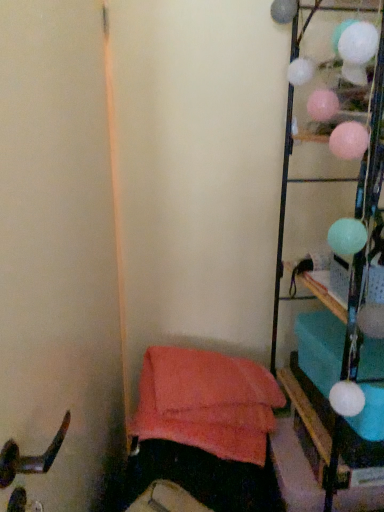
Identify the location of soft coral fabric bean bag chair at lower left. Image resolution: width=384 pixels, height=512 pixels. (207, 402).

What do you see at coordinates (207, 402) in the screenshot?
I see `soft coral fabric bean bag chair at lower left` at bounding box center [207, 402].

This screenshot has height=512, width=384. Describe the element at coordinates (373, 140) in the screenshot. I see `metallic wire rack at right` at that location.

In order to face metallic wire rack at right, should I rotate leftwards or rightwards?

To align with it, rotate right about 23.492°.

Measure the distance between metallic wire rack at right and camera.

metallic wire rack at right is 1.01 meters away from camera.

The height and width of the screenshot is (512, 384). What are the coordinates of `metallic wire rack at right` in the screenshot? It's located at (373, 140).

Locate an element on the screen. soft coral fabric bean bag chair at lower left is located at coordinates (207, 402).

Is soft coral fabric bean bag chair at lower left at the right side of metallic wire rack at right?

In fact, soft coral fabric bean bag chair at lower left is to the left of metallic wire rack at right.

Who is more distant, soft coral fabric bean bag chair at lower left or metallic wire rack at right?

soft coral fabric bean bag chair at lower left.

Is point (157, 367) closer to viewer compared to point (380, 184)?

No.

From the image's perspective, is soft coral fabric bean bag chair at lower left positioned above or below metallic wire rack at right?

soft coral fabric bean bag chair at lower left is situated lower than metallic wire rack at right in the image.

From a real-world perspective, who is located lower, soft coral fabric bean bag chair at lower left or metallic wire rack at right?

soft coral fabric bean bag chair at lower left.

Can you confirm if soft coral fabric bean bag chair at lower left is thinner than metallic wire rack at right?

Yes, soft coral fabric bean bag chair at lower left is thinner than metallic wire rack at right.

Who is taller, soft coral fabric bean bag chair at lower left or metallic wire rack at right?

Standing taller between the two is metallic wire rack at right.

Between soft coral fabric bean bag chair at lower left and metallic wire rack at right, which one has smaller size?

Smaller between the two is soft coral fabric bean bag chair at lower left.

Is soft coral fabric bean bag chair at lower left not within metallic wire rack at right?

Absolutely, soft coral fabric bean bag chair at lower left is external to metallic wire rack at right.

Is soft coral fabric bean bag chair at lower left next to metallic wire rack at right?

They are not placed beside each other.

Is soft coral fabric bean bag chair at lower left aimed at metallic wire rack at right?

No, soft coral fabric bean bag chair at lower left is not oriented towards metallic wire rack at right.

What's the angular difference between soft coral fabric bean bag chair at lower left and metallic wire rack at right's facing directions?

82.1 degrees separate the facing orientations of soft coral fabric bean bag chair at lower left and metallic wire rack at right.

Locate an element on the screen. bean bag chair behind the metallic wire rack at right is located at coordinates (207, 402).

In the image, is metallic wire rack at right on the left side or the right side of soft coral fabric bean bag chair at lower left?

In the image, metallic wire rack at right appears on the right side of soft coral fabric bean bag chair at lower left.

Which object is more forward, metallic wire rack at right or soft coral fabric bean bag chair at lower left?

Positioned in front is metallic wire rack at right.

Which point is more distant from viewer, (x=331, y=448) or (x=202, y=389)?

The point (x=202, y=389) is farther.

From the image's perspective, is metallic wire rack at right below soft coral fabric bean bag chair at lower left?

Incorrect, from the image's perspective, metallic wire rack at right is higher than soft coral fabric bean bag chair at lower left.

From a real-world perspective, who is located higher, metallic wire rack at right or soft coral fabric bean bag chair at lower left?

From a 3D spatial view, metallic wire rack at right is above.

Is metallic wire rack at right thinner than soft coral fabric bean bag chair at lower left?

In fact, metallic wire rack at right might be wider than soft coral fabric bean bag chair at lower left.

Which of these two, metallic wire rack at right or soft coral fabric bean bag chair at lower left, stands shorter?

Standing shorter between the two is soft coral fabric bean bag chair at lower left.

Is metallic wire rack at right bigger or smaller than soft coral fabric bean bag chair at lower left?

Clearly, metallic wire rack at right is larger in size than soft coral fabric bean bag chair at lower left.

Consider the image. Would you say metallic wire rack at right is outside soft coral fabric bean bag chair at lower left?

That's correct, metallic wire rack at right is outside of soft coral fabric bean bag chair at lower left.

Is metallic wire rack at right not near soft coral fabric bean bag chair at lower left?

No, metallic wire rack at right is not far away from soft coral fabric bean bag chair at lower left.

Is metallic wire rack at right positioned with its back to soft coral fabric bean bag chair at lower left?

Absolutely, metallic wire rack at right is directed away from soft coral fabric bean bag chair at lower left.

Image resolution: width=384 pixels, height=512 pixels. In order to click on bean bag chair that is on the left side of metallic wire rack at right in this screenshot , I will do `click(207, 402)`.

The image size is (384, 512). I want to click on furniture on the right of soft coral fabric bean bag chair at lower left, so click(x=373, y=140).

Where is `bean bag chair located behind the metallic wire rack at right`? bean bag chair located behind the metallic wire rack at right is located at coordinates (207, 402).